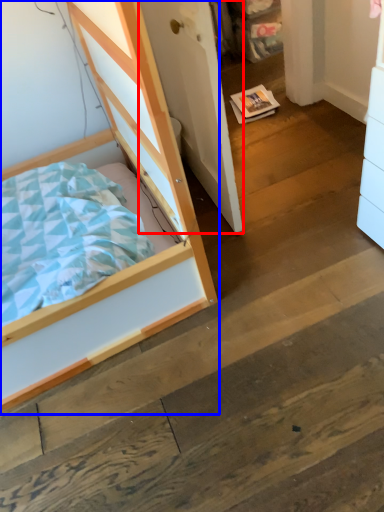
Question: Among these objects, which one is nearest to the camera, door (highlighted by a red box) or bed (highlighted by a blue box)?

Choices:
 (A) door
 (B) bed

Answer: (B)